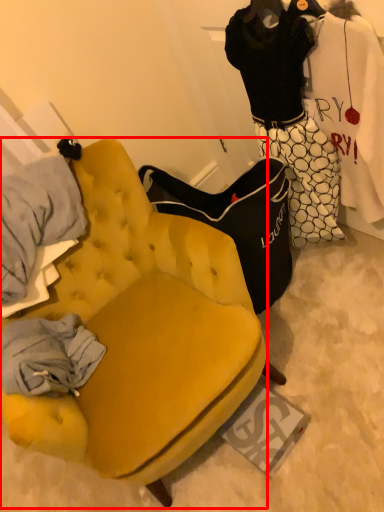
Question: Where is chair (annotated by the red box) located in relation to couple in the image?

Choices:
 (A) right
 (B) left

Answer: (B)